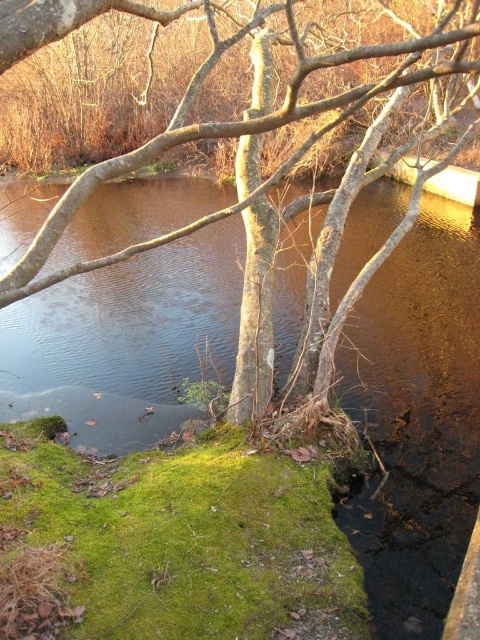
Question: Does brown smooth water at center lie in front of brown bark tree at center?

Choices:
 (A) no
 (B) yes

Answer: (A)

Question: Which object is closer to the camera taking this photo?

Choices:
 (A) brown bark tree at center
 (B) brown smooth water at center

Answer: (A)

Question: Is brown smooth water at center above brown bark tree at center?

Choices:
 (A) yes
 (B) no

Answer: (B)

Question: Among these objects, which one is farthest from the camera?

Choices:
 (A) brown smooth water at center
 (B) brown bark tree at center

Answer: (A)

Question: Does brown smooth water at center lie behind brown bark tree at center?

Choices:
 (A) no
 (B) yes

Answer: (B)

Question: Among these points, which one is farthest from the camera?

Choices:
 (A) (68, 365)
 (B) (244, 202)

Answer: (A)